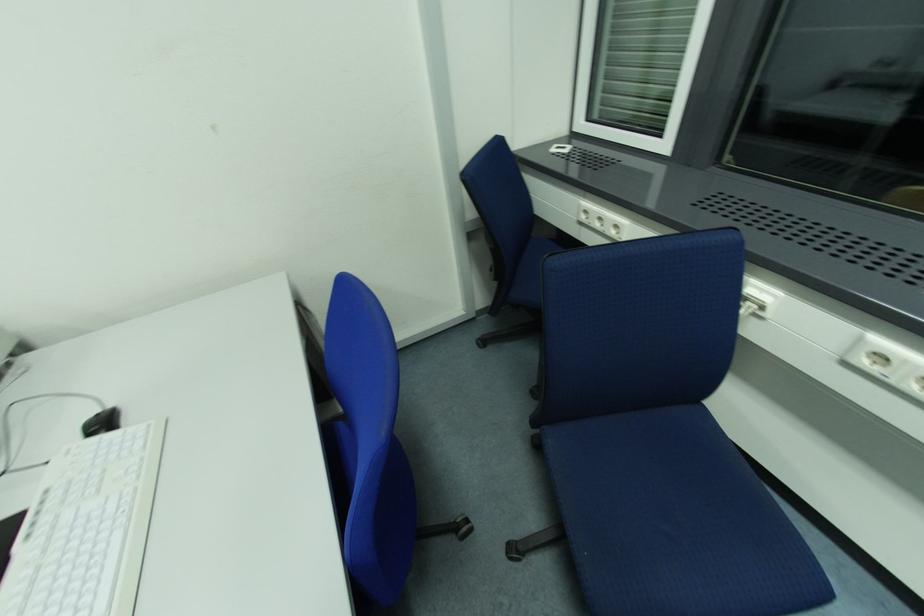
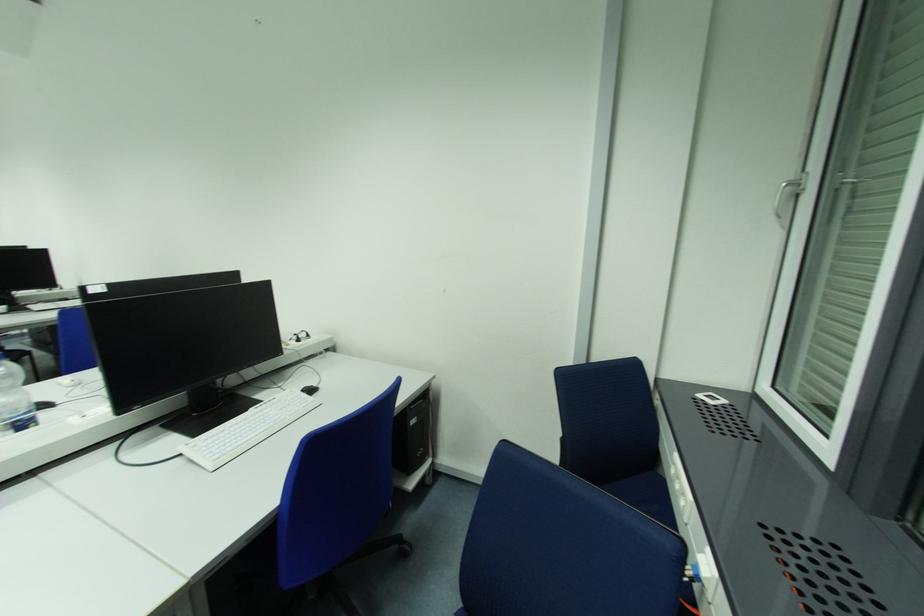
Find the pixel in the second image that matches the point at 50,493 in the first image.

(276, 400)